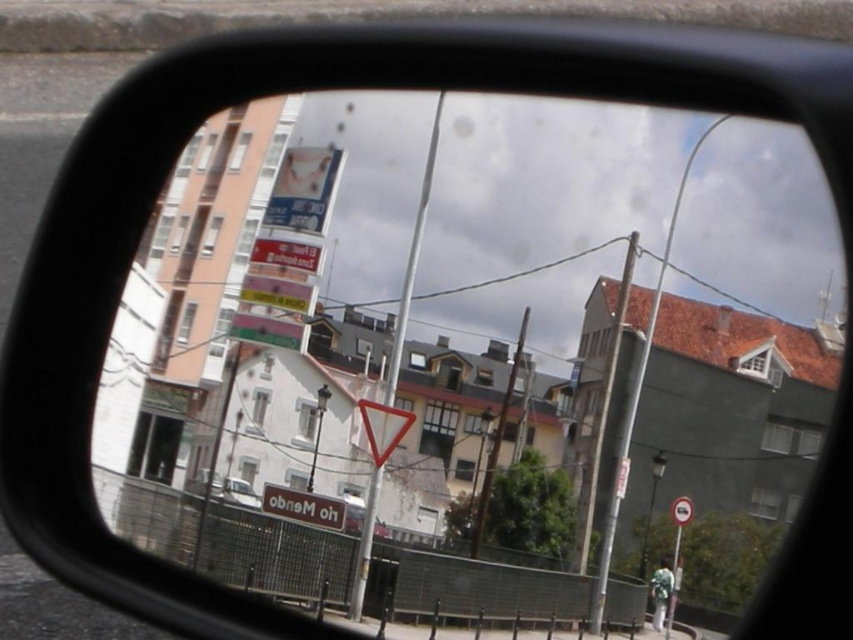
Does white plastic traffic sign at center appear on the right side of metallic silver car at center?

No, white plastic traffic sign at center is not to the right of metallic silver car at center.

Can you confirm if white plastic traffic sign at center is smaller than metallic silver car at center?

No.

Where is `white plastic traffic sign at center`? white plastic traffic sign at center is located at coordinates (303, 506).

This screenshot has height=640, width=853. I want to click on white plastic traffic sign at center, so click(x=303, y=506).